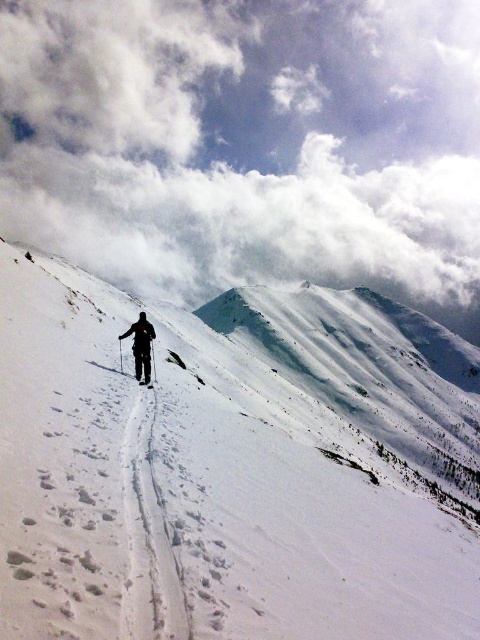
Question: Considering the real-world distances, which object is farthest from the white matte ski at center?

Choices:
 (A) dark gray ski suit at center
 (B) white snow ski slope at center

Answer: (B)

Question: In this image, where is white snow ski slope at center located relative to white matte ski at center?

Choices:
 (A) left
 (B) right

Answer: (B)

Question: Which is farther from the white matte ski at center?

Choices:
 (A) dark gray ski suit at center
 (B) white snow ski slope at center

Answer: (B)

Question: Is dark gray ski suit at center positioned at the back of white matte ski at center?

Choices:
 (A) no
 (B) yes

Answer: (B)

Question: Observing the image, what is the correct spatial positioning of white snow ski slope at center in reference to dark gray ski suit at center?

Choices:
 (A) below
 (B) above

Answer: (A)

Question: Which point is farther to the camera?

Choices:
 (A) white snow ski slope at center
 (B) white matte ski at center
 (C) dark gray ski suit at center

Answer: (C)